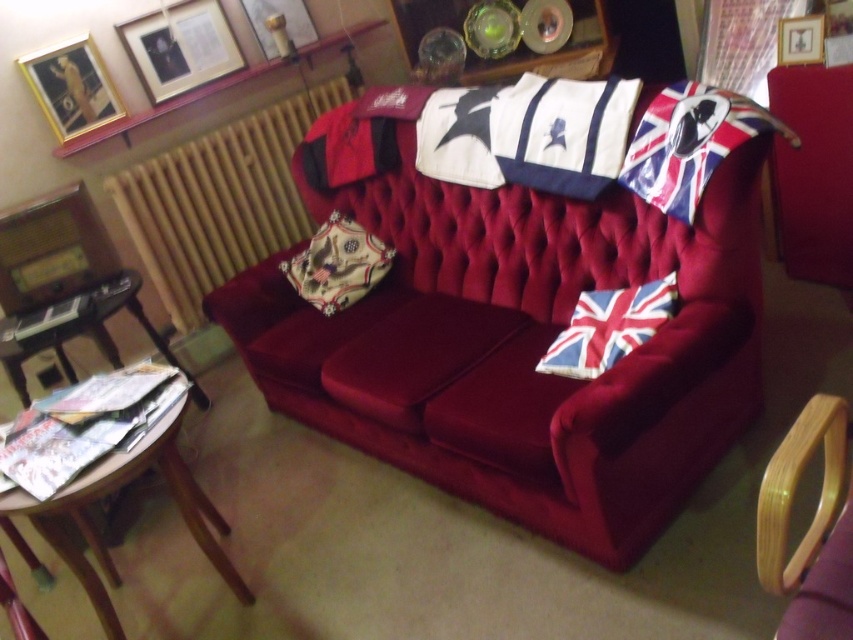
Does velvet couch at center appear over union jack fabric flag at upper right?

Actually, velvet couch at center is below union jack fabric flag at upper right.

The image size is (853, 640). What are the coordinates of `velvet couch at center` in the screenshot? It's located at (512, 333).

Image resolution: width=853 pixels, height=640 pixels. Describe the element at coordinates (512, 333) in the screenshot. I see `velvet couch at center` at that location.

I want to click on velvet couch at center, so click(x=512, y=333).

Does point (813, 556) come in front of point (200, 28)?

That is True.

Is wooden armchair at lower right wider than matte gold picture frame at upper left?

Incorrect, wooden armchair at lower right's width does not surpass matte gold picture frame at upper left's.

Is point (819, 404) more distant than point (178, 52)?

That is False.

Where is `wooden armchair at lower right`? wooden armchair at lower right is located at coordinates (809, 525).

What do you see at coordinates (219, 200) in the screenshot?
I see `wooden radiator at upper center` at bounding box center [219, 200].

Which of these two, wooden radiator at upper center or whitematerialflag at upper center, stands taller?

wooden radiator at upper center

The image size is (853, 640). I want to click on wooden radiator at upper center, so tap(219, 200).

Where is `wooden radiator at upper center`? This screenshot has height=640, width=853. wooden radiator at upper center is located at coordinates (219, 200).